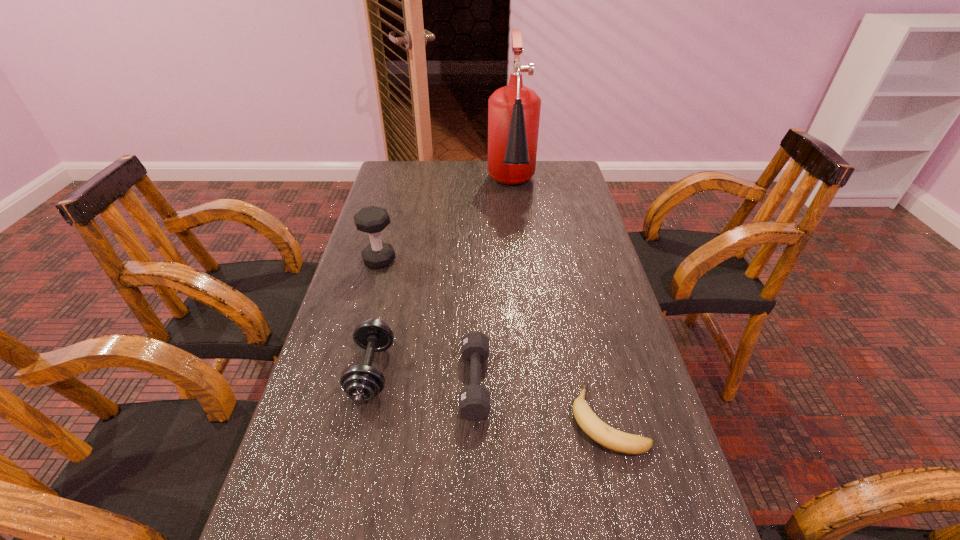
I want to click on vacant region located 0.210m on the back of the third shortest object, so click(393, 278).

Locate an element on the screen. The width and height of the screenshot is (960, 540). vacant space located 0.170m on the right of the shortest dumbbell is located at coordinates (566, 382).

The image size is (960, 540). Identify the location of vacant region located 0.180m on the back of the shortest object. (585, 325).

The width and height of the screenshot is (960, 540). Identify the location of object that is positioned at the far edge. (514, 110).

Where is `object located in the right edge section of the desktop`? The height and width of the screenshot is (540, 960). object located in the right edge section of the desktop is located at coordinates (594, 427).

This screenshot has height=540, width=960. I want to click on free space at the far edge of the desktop, so click(428, 184).

Identify the location of vacant space at the left edge of the desktop. The height and width of the screenshot is (540, 960). (396, 239).

The width and height of the screenshot is (960, 540). In the image, there is a desktop. Find the location of `free space at the right edge`. free space at the right edge is located at coordinates (580, 385).

In the image, there is a desktop. At what (x,y) coordinates should I click in order to perform the action: click on vacant space at the far left corner. Please return your answer as a coordinate pair (x, y). Looking at the image, I should click on (380, 190).

Where is `free region at the far right corner of the desktop`? Image resolution: width=960 pixels, height=540 pixels. free region at the far right corner of the desktop is located at coordinates (564, 180).